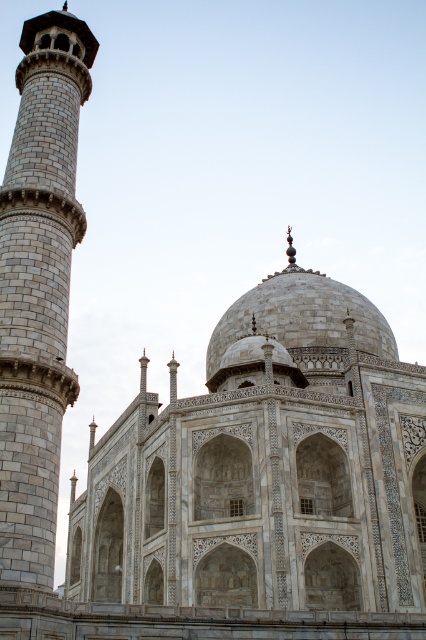
Who is shorter, white marble tower at left or white marble dome at center?

white marble dome at center is shorter.

Between point (60, 125) and point (393, 349), which one is positioned behind?

The point (393, 349) is more distant.

Identify the location of white marble tower at left. (39, 288).